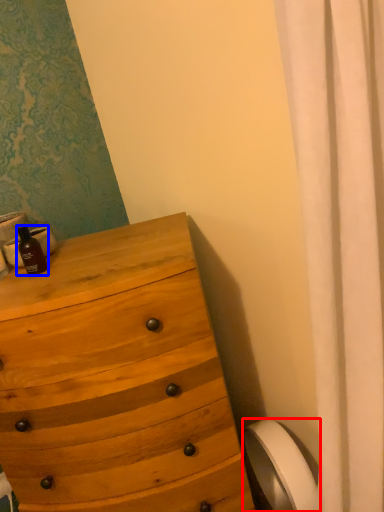
Question: Which object is closer to the camera taking this photo, toilet paper (highlighted by a red box) or bottle (highlighted by a blue box)?

Choices:
 (A) toilet paper
 (B) bottle

Answer: (B)